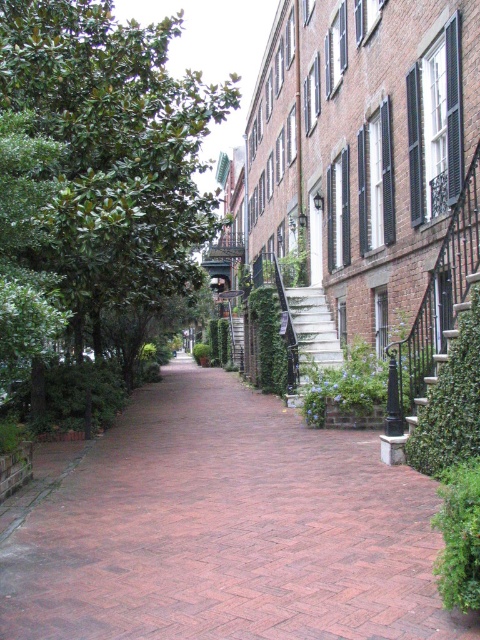
Can you confirm if green ivy bush at center is bigger than wooden staircase at center?

No, green ivy bush at center is not bigger than wooden staircase at center.

Is point (279, 371) positioned in front of point (236, 364)?

Yes, point (279, 371) is in front of point (236, 364).

At what (x,y) coordinates should I click in order to perform the action: click on green ivy bush at center. Please return your answer as a coordinate pair (x, y). Looking at the image, I should click on (268, 339).

I want to click on green ivy bush at center, so click(x=268, y=339).

How much distance is there between green leafy bush at right and green ivy bush at center?

green leafy bush at right and green ivy bush at center are 35.21 feet apart from each other.

Looking at this image, can you confirm if green leafy bush at right is bigger than green ivy bush at center?

No, green leafy bush at right is not bigger than green ivy bush at center.

Locate an element on the screen. Image resolution: width=480 pixels, height=640 pixels. green leafy bush at right is located at coordinates (451, 403).

This screenshot has height=640, width=480. Find the location of `green leafy bush at right`. green leafy bush at right is located at coordinates (451, 403).

Does green leafy bush at lower right appear on the right side of white concrete stairs at center?

Incorrect, green leafy bush at lower right is not on the right side of white concrete stairs at center.

Between green leafy bush at lower right and white concrete stairs at center, which one appears on the left side from the viewer's perspective?

Positioned to the left is green leafy bush at lower right.

Does point (467, 570) come closer to viewer compared to point (308, 364)?

Yes.

At what (x,y) coordinates should I click in order to perform the action: click on green leafy bush at lower right. Please return your answer as a coordinate pair (x, y). Looking at the image, I should click on 458,536.